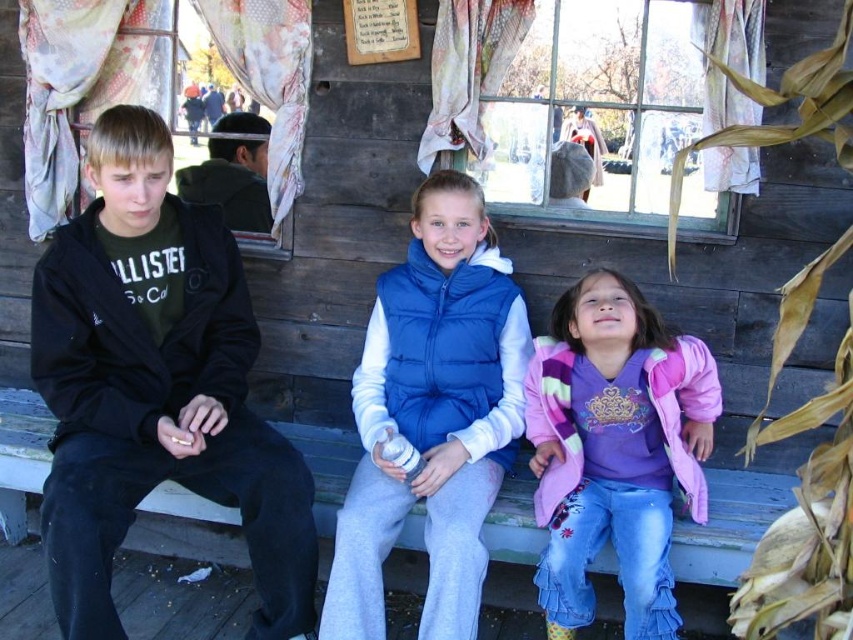
Question: Which object appears farthest from the camera in this image?

Choices:
 (A) pink fleece jacket at lower right
 (B) blue puffy vest at center

Answer: (A)

Question: Which object is farther from the camera taking this photo?

Choices:
 (A) blue puffy vest at center
 (B) black matte jacket at left

Answer: (A)

Question: Which of these objects is positioned farthest from the pink fleece jacket at lower right?

Choices:
 (A) black matte jacket at left
 (B) blue puffy vest at center

Answer: (A)

Question: Is blue puffy vest at center bigger than pink fleece jacket at lower right?

Choices:
 (A) no
 (B) yes

Answer: (B)

Question: Does black matte jacket at left appear on the left side of pink fleece jacket at lower right?

Choices:
 (A) no
 (B) yes

Answer: (B)

Question: Can you confirm if black matte jacket at left is positioned to the right of blue puffy vest at center?

Choices:
 (A) yes
 (B) no

Answer: (B)